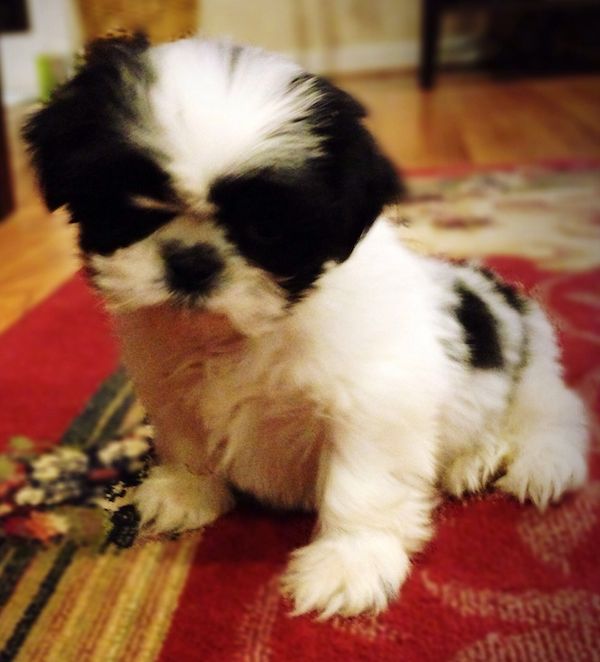
Find the location of a particular element. The image size is (600, 662). white floor molding is located at coordinates (373, 62).